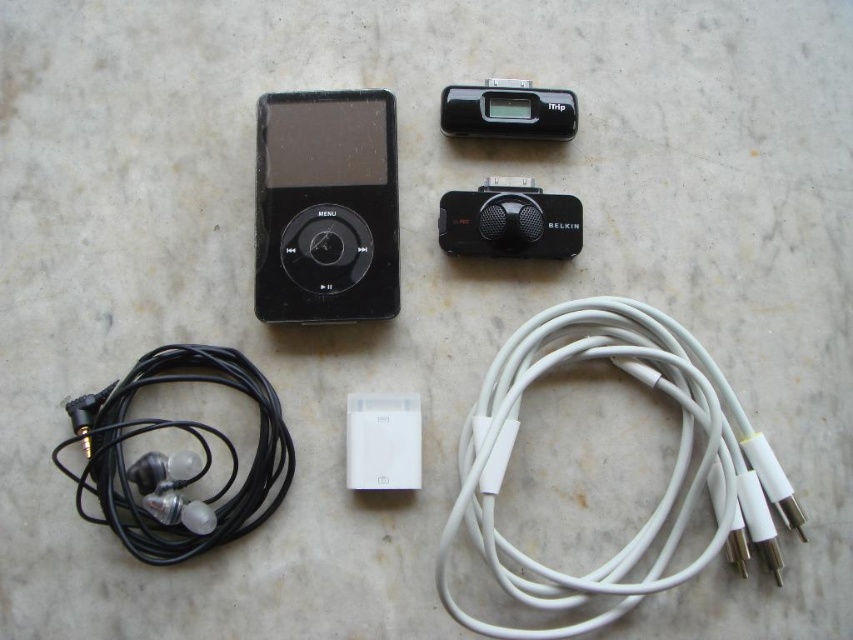
You are organizing a display of electronic devices. You have a white plastic ipod at center and a black plastic ipod at upper center. Which iPod is closer to you in the arrangement?

The white plastic ipod at center is closer to you because it is in front of the black plastic ipod at upper center.

You are setting up a small speaker system on a table and have the black plastic speaker at center and the white plastic ipod at center. If you want to place a decorative item between them, where should you position it to ensure it is equidistant from both?

The black plastic speaker at center is closer to you than the white plastic ipod at center. To place a decorative item equidistant between them, position it closer to the white plastic ipod at center since the speaker is nearer to you.